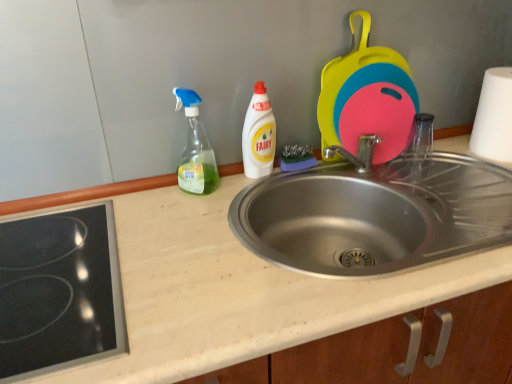
You are a GUI agent. You are given a task and a screenshot of the screen. Output one action in this format:
    pyautogui.click(x=<x>, y=<y>)
    Task: Click on the white plastic bottle at center, which is the first bottle from right to left
    The height and width of the screenshot is (384, 512).
    Given the screenshot: What is the action you would take?
    pyautogui.click(x=259, y=135)

In order to face stainless steel sink at center, should I rotate leftwards or rightwards?

Rotate your view right by about 17.732°.

The width and height of the screenshot is (512, 384). What do you see at coordinates (195, 149) in the screenshot?
I see `transparent plastic spray bottle at center, the 1th bottle in the left-to-right sequence` at bounding box center [195, 149].

Where is `white plastic bottle at center, which is the first bottle from right to left`? Image resolution: width=512 pixels, height=384 pixels. white plastic bottle at center, which is the first bottle from right to left is located at coordinates pos(259,135).

Does stainless steel sink at center lie behind white matte paper towel at right?

No, it is not.

In terms of width, does stainless steel sink at center look wider or thinner when compared to white matte paper towel at right?

Considering their sizes, stainless steel sink at center looks broader than white matte paper towel at right.

Considering the positions of points (422, 168) and (495, 116), is point (422, 168) closer to camera compared to point (495, 116)?

No, (422, 168) is behind (495, 116).

Do you think stainless steel sink at center is within white matte paper towel at right, or outside of it?

stainless steel sink at center exists outside the volume of white matte paper towel at right.

Find the location of `gas stove on the left of stainless steel sink at center`. gas stove on the left of stainless steel sink at center is located at coordinates (59, 291).

Consider the image. Considering the relative sizes of stainless steel sink at center and black glass cooktop at lower left in the image provided, is stainless steel sink at center smaller than black glass cooktop at lower left?

Incorrect, stainless steel sink at center is not smaller in size than black glass cooktop at lower left.

Is stainless steel sink at center positioned with its back to black glass cooktop at lower left?

No, stainless steel sink at center's orientation is not away from black glass cooktop at lower left.

Is stainless steel sink at center spatially inside black glass cooktop at lower left, or outside of it?

stainless steel sink at center is located beyond the bounds of black glass cooktop at lower left.

From a real-world perspective, is white plastic bottle at center, which ranks as the 2th bottle in left-to-right order, above or below white matte paper towel at right?

white plastic bottle at center, which ranks as the 2th bottle in left-to-right order, is above white matte paper towel at right.

Between white plastic bottle at center, which ranks as the 2th bottle in left-to-right order, and white matte paper towel at right, which one has less height?

Standing shorter between the two is white matte paper towel at right.

Which object is closer to the camera taking this photo, white plastic bottle at center, which ranks as the 2th bottle in left-to-right order, or white matte paper towel at right?

Positioned in front is white plastic bottle at center, which ranks as the 2th bottle in left-to-right order.

Are white plastic bottle at center, which is the first bottle from right to left, and white matte paper towel at right located far from each other?

That's not correct — white plastic bottle at center, which is the first bottle from right to left, is a little close to white matte paper towel at right.

Do you think white matte paper towel at right is within black glass cooktop at lower left, or outside of it?

white matte paper towel at right is not inside black glass cooktop at lower left, it's outside.

Considering the positions of objects white matte paper towel at right and black glass cooktop at lower left in the image provided, who is more to the left, white matte paper towel at right or black glass cooktop at lower left?

Positioned to the left is black glass cooktop at lower left.

From a real-world perspective, which is physically below, white matte paper towel at right or black glass cooktop at lower left?

black glass cooktop at lower left.

Is white matte paper towel at right facing away from black glass cooktop at lower left?

No, white matte paper towel at right is not facing the opposite direction of black glass cooktop at lower left.

Is beige laminate counter top at center to the right of white matte paper towel at right from the viewer's perspective?

No, beige laminate counter top at center is not to the right of white matte paper towel at right.

From the image's perspective, who appears lower, beige laminate counter top at center or white matte paper towel at right?

beige laminate counter top at center.

In the scene shown: Can you see beige laminate counter top at center touching white matte paper towel at right?

There is a gap between beige laminate counter top at center and white matte paper towel at right.

Does beige laminate counter top at center have a smaller size compared to white matte paper towel at right?

No.

Which is behind, point (504, 152) or point (415, 308)?

Positioned behind is point (504, 152).

Considering the relative sizes of white matte paper towel at right and beige laminate counter top at center in the image provided, is white matte paper towel at right shorter than beige laminate counter top at center?

Yes.

Considering the sizes of objects white matte paper towel at right and beige laminate counter top at center in the image provided, who is smaller, white matte paper towel at right or beige laminate counter top at center?

With smaller size is white matte paper towel at right.

Is white matte paper towel at right facing away from beige laminate counter top at center?

No, white matte paper towel at right is not facing the opposite direction of beige laminate counter top at center.

Between white plastic bottle at center, which ranks as the 2th bottle in left-to-right order, and beige laminate counter top at center, which one has less height?

white plastic bottle at center, which ranks as the 2th bottle in left-to-right order.

Is white plastic bottle at center, which is the first bottle from right to left, oriented away from beige laminate counter top at center?

No, beige laminate counter top at center is not at the back of white plastic bottle at center, which is the first bottle from right to left.

Which is nearer, (253,104) or (175,206)?

Point (175,206)

Considering the positions of objects white plastic bottle at center, which ranks as the 2th bottle in left-to-right order, and beige laminate counter top at center in the image provided, who is more to the left, white plastic bottle at center, which ranks as the 2th bottle in left-to-right order, or beige laminate counter top at center?

white plastic bottle at center, which ranks as the 2th bottle in left-to-right order.

At what (x,y) coordinates should I click in order to perform the action: click on paper towel above the stainless steel sink at center (from a real-world perspective). Please return your answer as a coordinate pair (x, y). Looking at the image, I should click on (494, 117).

Identify the location of gas stove that is below the stainless steel sink at center (from the image's perspective). This screenshot has width=512, height=384. (59, 291).

From the image, which object appears to be farther from black glass cooktop at lower left, beige laminate counter top at center or transparent plastic spray bottle at center, the 2th bottle in the right-to-left sequence?

transparent plastic spray bottle at center, the 2th bottle in the right-to-left sequence, lies further to black glass cooktop at lower left than the other object.

Based on their spatial positions, is stainless steel sink at center or white matte paper towel at right further from silicone cutting boards at upper right?

Based on the image, white matte paper towel at right appears to be further to silicone cutting boards at upper right.

Looking at this image, based on their spatial positions, is white plastic bottle at center, which ranks as the 2th bottle in left-to-right order, or stainless steel sink at center further from silicone cutting boards at upper right?

white plastic bottle at center, which ranks as the 2th bottle in left-to-right order.

Which object lies nearer to the anchor point transparent plastic spray bottle at center, the 2th bottle in the right-to-left sequence, white plastic bottle at center, which is the first bottle from right to left, or beige laminate counter top at center?

white plastic bottle at center, which is the first bottle from right to left, is positioned closer to the anchor transparent plastic spray bottle at center, the 2th bottle in the right-to-left sequence.

Based on their spatial positions, is stainless steel sink at center or white plastic bottle at center, which ranks as the 2th bottle in left-to-right order, further from transparent plastic spray bottle at center, the 2th bottle in the right-to-left sequence?

stainless steel sink at center lies further to transparent plastic spray bottle at center, the 2th bottle in the right-to-left sequence, than the other object.

Looking at the image, which one is located further to white matte paper towel at right, white plastic bottle at center, which is the first bottle from right to left, or silicone cutting boards at upper right?

white plastic bottle at center, which is the first bottle from right to left.

From the image, which object appears to be farther from stainless steel sink at center, black glass cooktop at lower left or white matte paper towel at right?

Among the two, black glass cooktop at lower left is located further to stainless steel sink at center.

Estimate the real-world distances between objects in this image. Which object is further from transparent plastic spray bottle at center, the 1th bottle in the left-to-right sequence, beige laminate counter top at center or silicone cutting boards at upper right?

silicone cutting boards at upper right lies further to transparent plastic spray bottle at center, the 1th bottle in the left-to-right sequence, than the other object.

Find the location of a particular element. This screenshot has width=512, height=384. sink between white plastic bottle at center, which is the first bottle from right to left, and beige laminate counter top at center from top to bottom is located at coordinates (375, 215).

The image size is (512, 384). What are the coordinates of `sink situated between black glass cooktop at lower left and white matte paper towel at right from left to right` in the screenshot? It's located at (375, 215).

The width and height of the screenshot is (512, 384). Identify the location of appliance situated between black glass cooktop at lower left and stainless steel sink at center from left to right. [x=367, y=98].

Locate an element on the screen. sink that lies between silicone cutting boards at upper right and beige laminate counter top at center from top to bottom is located at coordinates (375, 215).